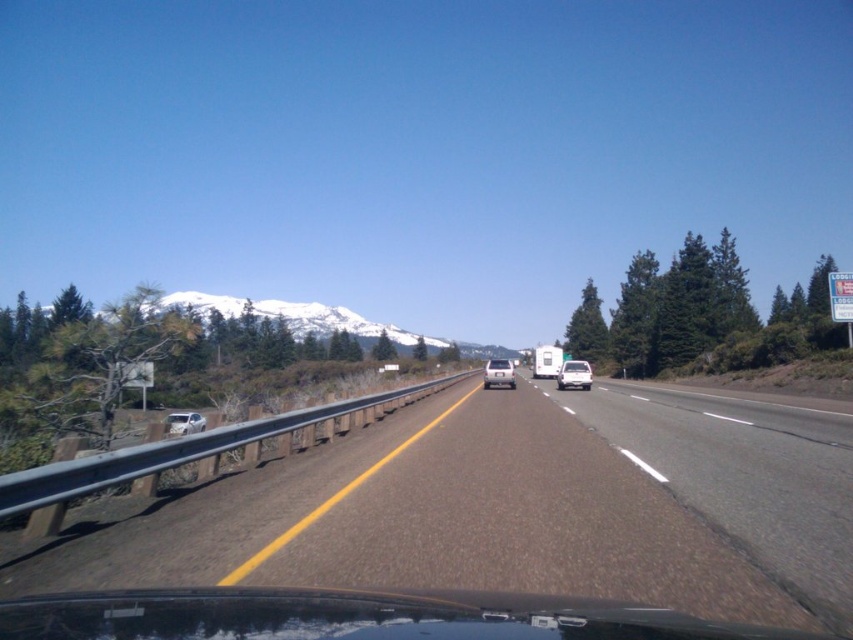
You are driving a car and see the asphalt road at center and the silver metallic car at center ahead. Which object is closer to you?

The asphalt road at center is in front of the silver metallic car at center, so the asphalt road at center is closer to you.

You are driving a car and see the white matte van at center and the satin silver sedan at left ahead on the highway. Which vehicle is closer to you as you drive forward?

The white matte van at center is closer to you because it is positioned further to the viewer than the satin silver sedan at left, meaning it is nearer in your line of sight as you drive forward.

You are a driver approaching the white matte truck at center on the highway. Based on its position coordinates, can you estimate whether it is positioned to the left or right side of the road?

The white matte truck at center is located at coordinates point (546, 362), which places it in the center of the road, neither to the left nor right side.